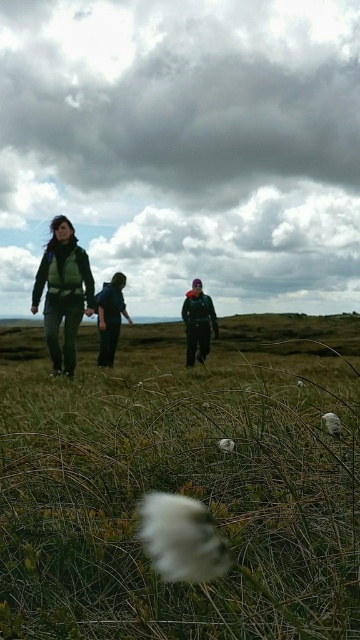
Question: Can you confirm if white fluffy cotton at center is positioned below dark green jacket at center?

Choices:
 (A) yes
 (B) no

Answer: (A)

Question: From the image, what is the correct spatial relationship of white fluffy grass at center in relation to white fluffy cotton at center?

Choices:
 (A) below
 (B) above

Answer: (A)

Question: Which of the following is the farthest from the observer?

Choices:
 (A) (254, 452)
 (B) (185, 312)
 (C) (50, 248)

Answer: (B)

Question: Observing the image, what is the correct spatial positioning of matte green vest at left in reference to dark green jacket at center?

Choices:
 (A) above
 (B) below

Answer: (A)

Question: Which object appears farthest from the camera in this image?

Choices:
 (A) white fluffy grass at center
 (B) white fluffy cotton at center

Answer: (B)

Question: Which of the following is the farthest from the observer?

Choices:
 (A) dark green fabric jacket at center
 (B) matte green vest at left
 (C) white fluffy cotton at center

Answer: (A)